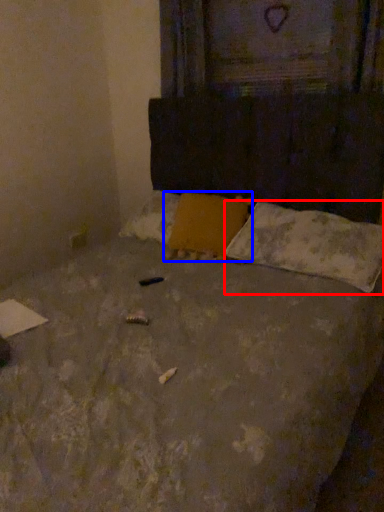
Question: Which point is closer to the camera, pillow (highlighted by a red box) or pillow (highlighted by a blue box)?

Choices:
 (A) pillow
 (B) pillow

Answer: (A)